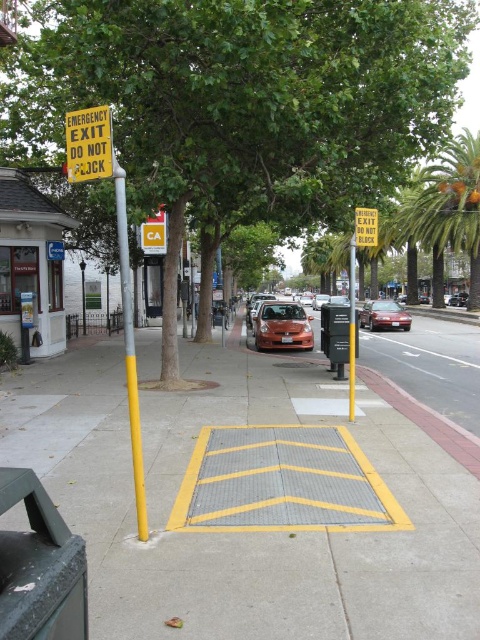
Is satin red car at center positioned behind yellow metallic pole at center?

Yes.

Between satin red car at center and yellow metallic pole at center, which one appears on the left side from the viewer's perspective?

From the viewer's perspective, satin red car at center appears more on the left side.

Is point (294, 310) behind point (351, 369)?

Yes, point (294, 310) is farther from viewer.

Locate an element on the screen. The width and height of the screenshot is (480, 640). satin red car at center is located at coordinates (282, 326).

Is yellow paper sign at upper left to the left of shiny orange car at center from the viewer's perspective?

Yes, yellow paper sign at upper left is to the left of shiny orange car at center.

Consider the image. Can you confirm if yellow paper sign at upper left is positioned below shiny orange car at center?

Yes.

Which is in front, point (86, 170) or point (316, 301)?

Point (86, 170) is in front.

Find the location of a particular element. yellow paper sign at upper left is located at coordinates (88, 145).

I want to click on yellow paper sign at upper left, so click(x=88, y=145).

Does yellow paper sign at upper left have a lesser width compared to yellow plastic sign at upper center?

No, yellow paper sign at upper left is not thinner than yellow plastic sign at upper center.

I want to click on yellow paper sign at upper left, so click(x=88, y=145).